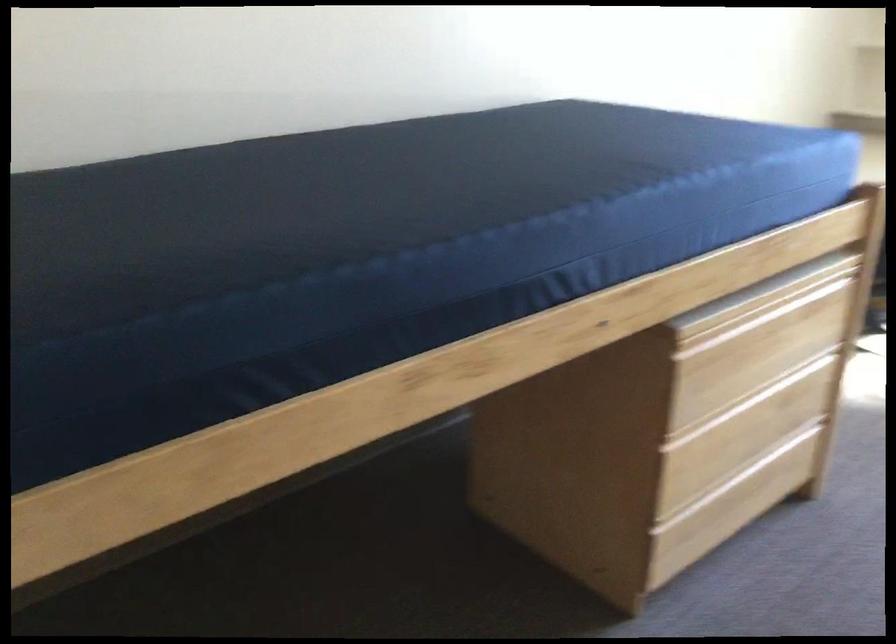
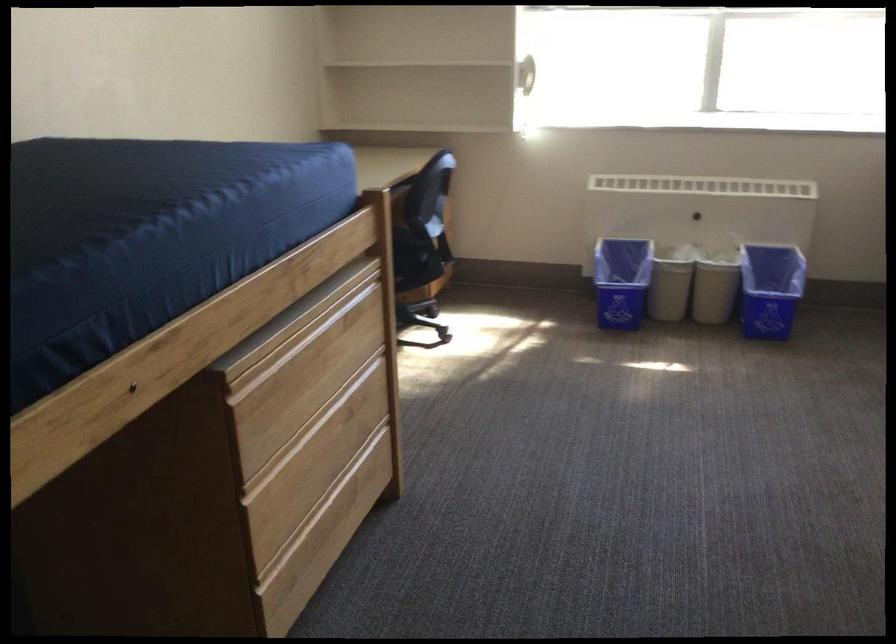
Locate, in the second image, the point that corresponds to (x=737, y=500) in the first image.

(330, 523)